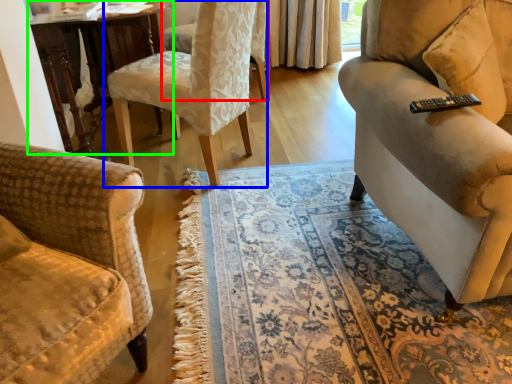
Question: Which object is the closest to the chair (highlighted by a red box)? Choose among these: chair (highlighted by a blue box) or table (highlighted by a green box).

Choices:
 (A) chair
 (B) table

Answer: (B)